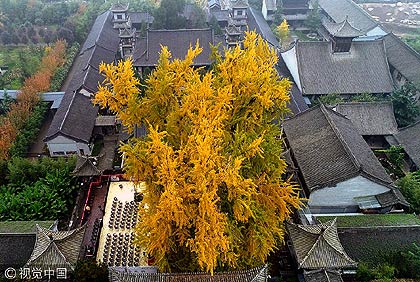
This screenshot has width=420, height=282. In order to click on window in this screenshot , I will do `click(119, 17)`.